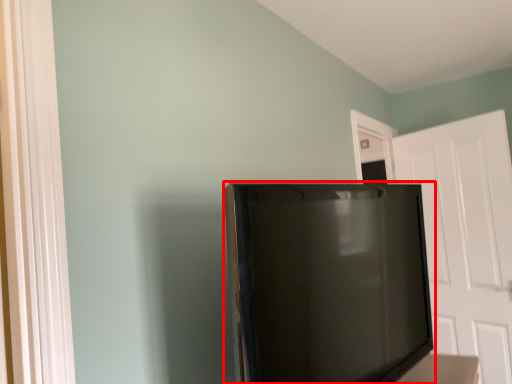
Question: From the image, what is the correct spatial relationship of refrigerator (annotated by the red box) in relation to door?

Choices:
 (A) right
 (B) left

Answer: (B)